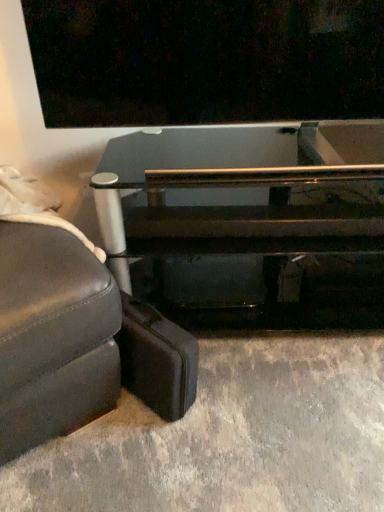
Question: Is leather studio couch at lower left far from leather suitcase at lower left?

Choices:
 (A) no
 (B) yes

Answer: (A)

Question: Is leather studio couch at lower left smaller than leather suitcase at lower left?

Choices:
 (A) yes
 (B) no

Answer: (B)

Question: From a real-world perspective, is leather studio couch at lower left on leather suitcase at lower left?

Choices:
 (A) yes
 (B) no

Answer: (A)

Question: Is leather studio couch at lower left facing away from leather suitcase at lower left?

Choices:
 (A) yes
 (B) no

Answer: (B)

Question: Can you confirm if leather studio couch at lower left is wider than leather suitcase at lower left?

Choices:
 (A) yes
 (B) no

Answer: (A)

Question: Is transparent glass table at center in front of or behind leather studio couch at lower left in the image?

Choices:
 (A) front
 (B) behind

Answer: (B)

Question: In terms of width, does transparent glass table at center look wider or thinner when compared to leather studio couch at lower left?

Choices:
 (A) thin
 (B) wide

Answer: (A)

Question: From a real-world perspective, is transparent glass table at center physically located above or below leather studio couch at lower left?

Choices:
 (A) above
 (B) below

Answer: (A)

Question: From the image's perspective, relative to leather studio couch at lower left, is transparent glass table at center above or below?

Choices:
 (A) above
 (B) below

Answer: (A)

Question: In the image, is transparent glass table at center on the left side or the right side of leather suitcase at lower left?

Choices:
 (A) left
 (B) right

Answer: (B)

Question: Looking at their shapes, would you say transparent glass table at center is wider or thinner than leather suitcase at lower left?

Choices:
 (A) thin
 (B) wide

Answer: (B)

Question: In the image, is transparent glass table at center positioned in front of or behind leather suitcase at lower left?

Choices:
 (A) front
 (B) behind

Answer: (B)

Question: From the image's perspective, relative to leather suitcase at lower left, is transparent glass table at center above or below?

Choices:
 (A) above
 (B) below

Answer: (A)

Question: Choose the correct answer: Is leather studio couch at lower left inside leather suitcase at lower left or outside it?

Choices:
 (A) outside
 (B) inside

Answer: (A)

Question: From a real-world perspective, is leather studio couch at lower left positioned above or below leather suitcase at lower left?

Choices:
 (A) above
 (B) below

Answer: (A)